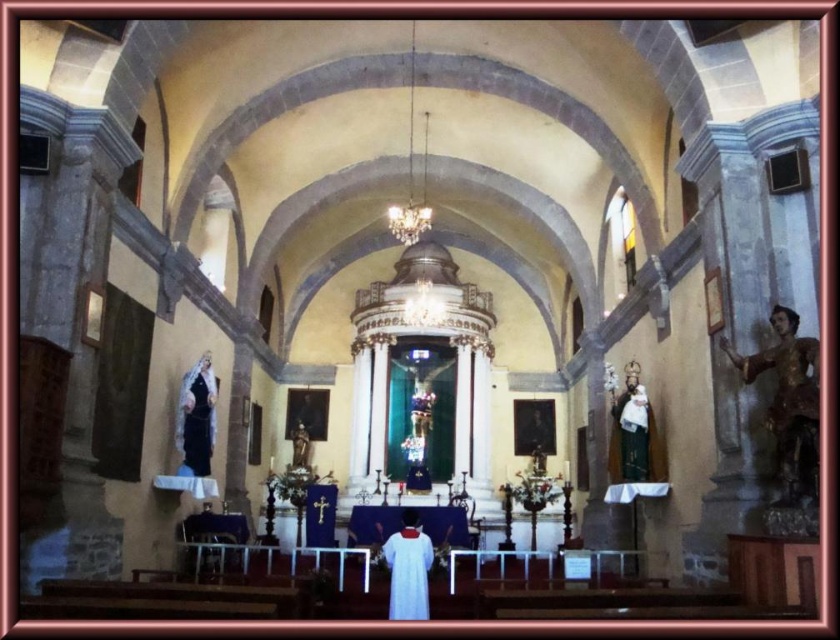
Question: Can you confirm if green velvet statue at right is wider than white cloth at center?

Choices:
 (A) no
 (B) yes

Answer: (A)

Question: Is white cloth at center to the right of matte white statue at left from the viewer's perspective?

Choices:
 (A) no
 (B) yes

Answer: (B)

Question: Which object appears farthest from the camera in this image?

Choices:
 (A) matte white statue at left
 (B) green velvet statue at right
 (C) wooden statue at right

Answer: (A)

Question: Which of the following is the farthest from the observer?

Choices:
 (A) (197, 449)
 (B) (413, 548)

Answer: (A)

Question: Considering the real-world distances, which object is farthest from the matte white statue at left?

Choices:
 (A) green velvet statue at right
 (B) white cloth at center
 (C) wooden statue at right

Answer: (C)

Question: Is green velvet statue at right to the left of matte white statue at left from the viewer's perspective?

Choices:
 (A) yes
 (B) no

Answer: (B)